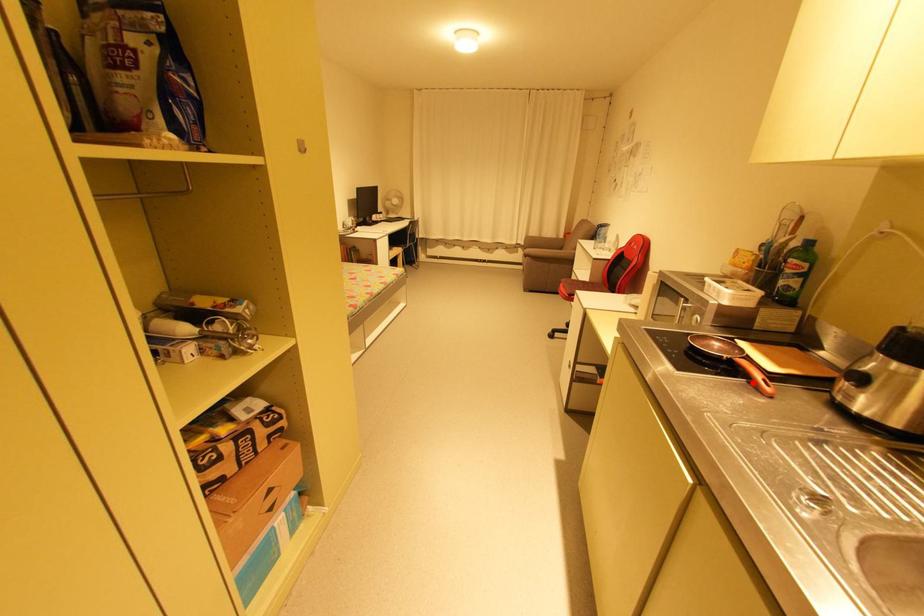
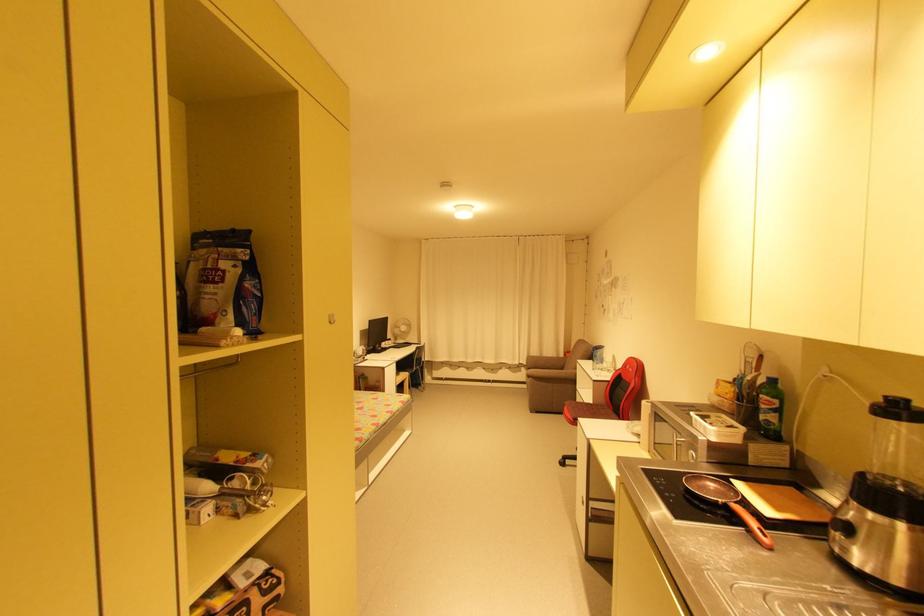
Locate, in the second image, the point that corresponds to the highlighted location in the first image.

(751, 532)